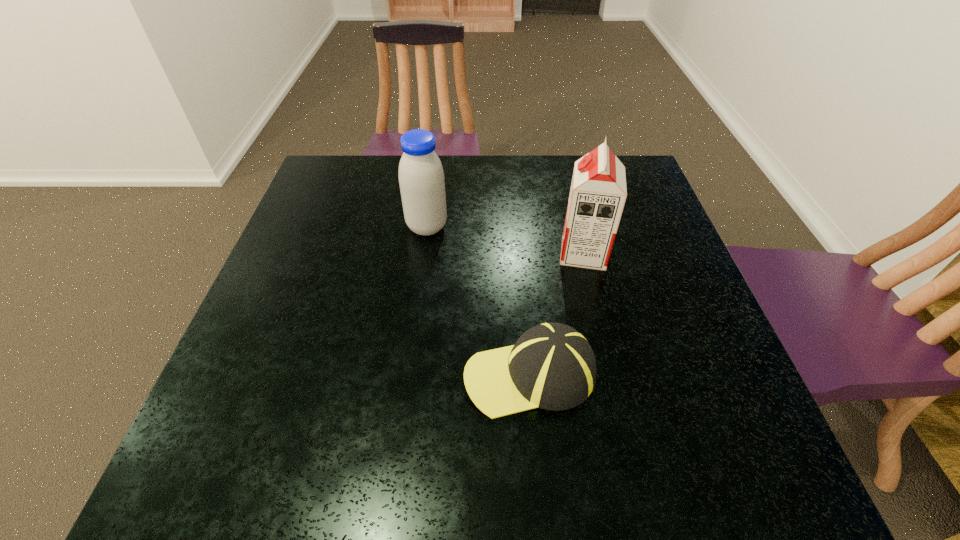
You are a GUI agent. You are given a task and a screenshot of the screen. Output one action in this format:
    pyautogui.click(x=<x>, y=<y>)
    Task: Click on the free space between the leftmost object and the right soya milk
    Image resolution: width=960 pixels, height=540 pixels.
    Given the screenshot: What is the action you would take?
    pyautogui.click(x=505, y=240)

Image resolution: width=960 pixels, height=540 pixels. I want to click on free space between the right soya milk and the leftmost object, so click(505, 240).

What are the coordinates of `free space between the leftmost object and the baseball cap` in the screenshot? It's located at (478, 301).

Identify the location of free spot between the left soya milk and the nearest object. The image size is (960, 540). (478, 301).

Locate an element on the screen. The image size is (960, 540). free space between the right soya milk and the leftmost object is located at coordinates (505, 240).

Where is `free space between the right soya milk and the left soya milk`? Image resolution: width=960 pixels, height=540 pixels. free space between the right soya milk and the left soya milk is located at coordinates (505, 240).

Locate an element on the screen. This screenshot has height=540, width=960. object that is the closest to the right soya milk is located at coordinates (552, 366).

Find the location of a particular element. This screenshot has width=960, height=540. object identified as the closest to the right soya milk is located at coordinates (552, 366).

Locate an element on the screen. free space that satisfies the following two spatial constraints: 1. on the front side of the right soya milk; 2. on the left side of the leftmost object is located at coordinates (423, 253).

Identify the location of vacant region that satisfies the following two spatial constraints: 1. on the front side of the right soya milk; 2. on the right side of the left soya milk. tap(423, 253).